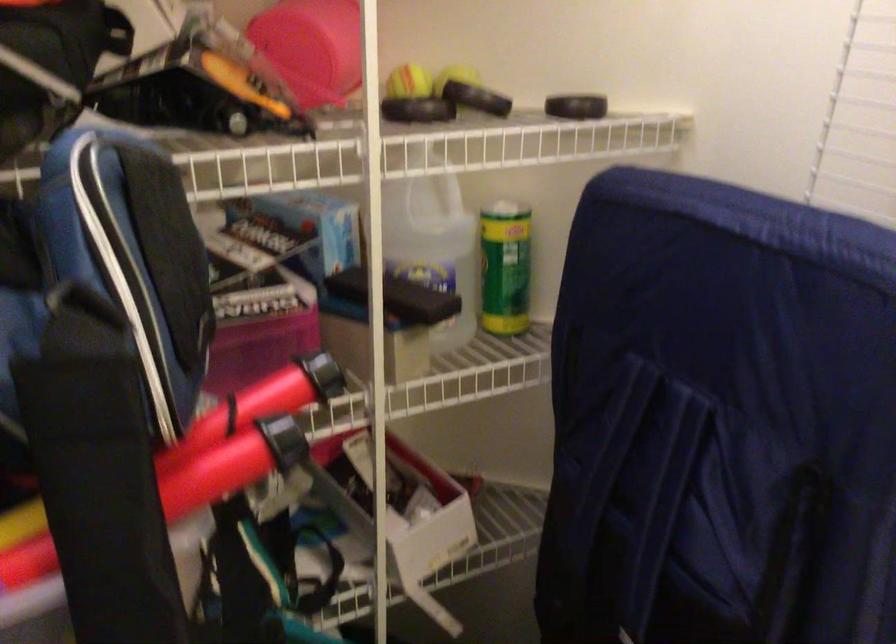
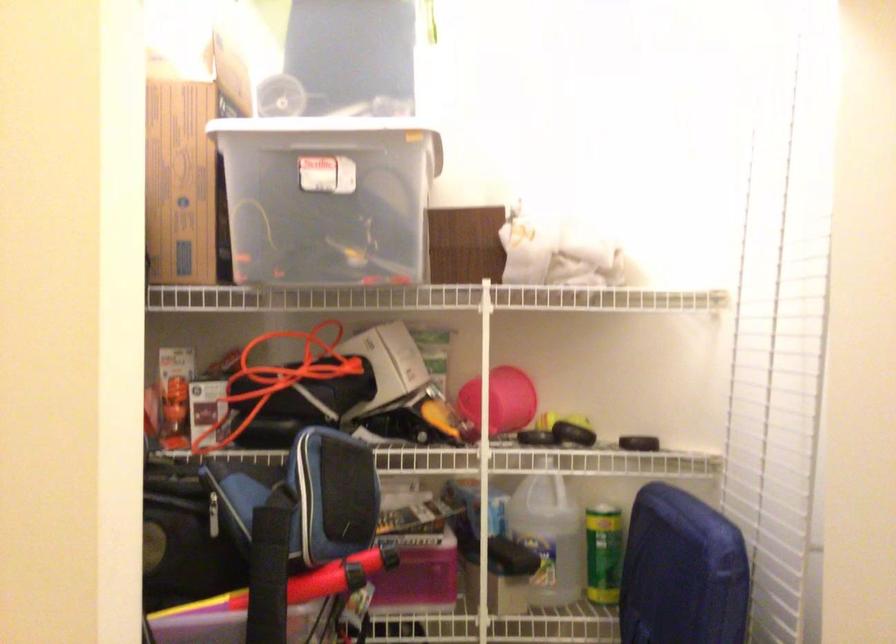
Where in the second image is the point corresponding to (812,313) from the first image?

(682, 572)